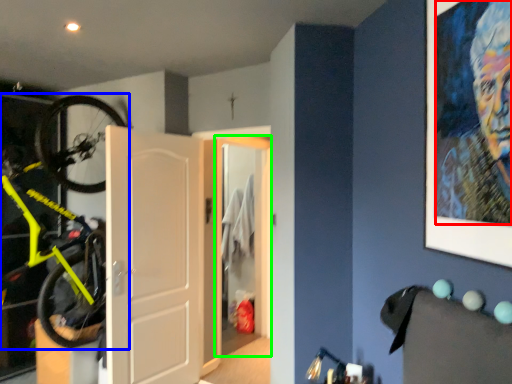
Question: Based on their relative distances, which object is nearer to person (highlighted by a red box)? Choose from bicycle (highlighted by a blue box) and door (highlighted by a green box).

Choices:
 (A) bicycle
 (B) door

Answer: (A)